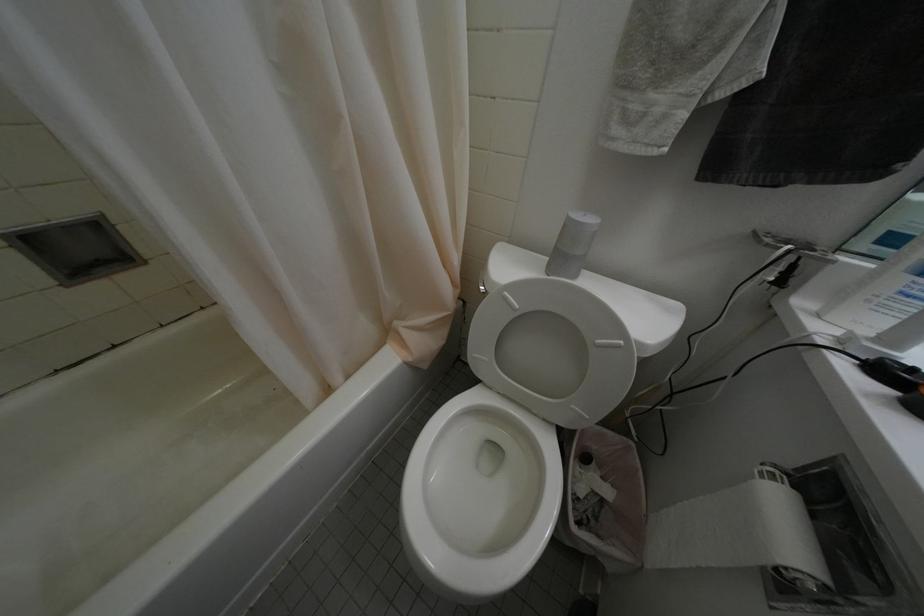
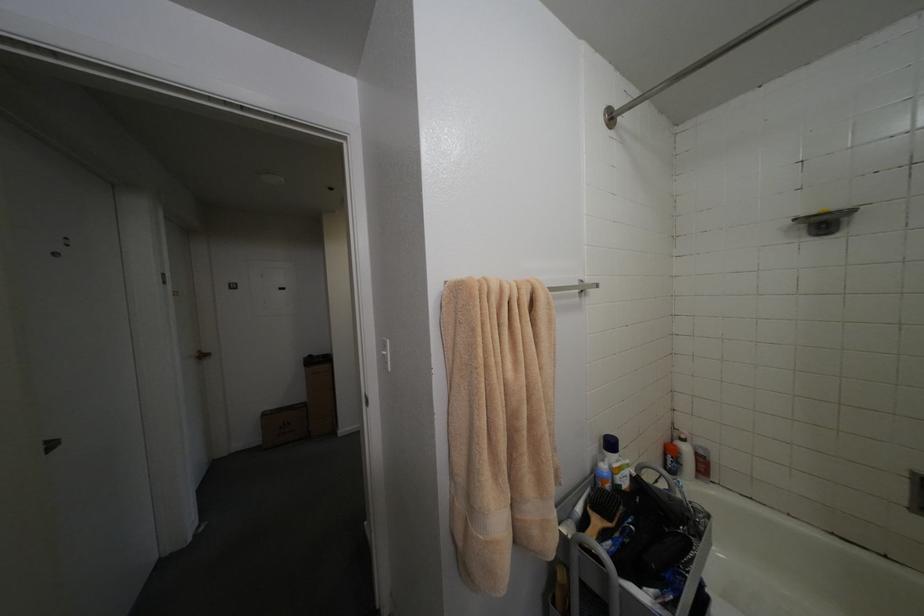
Question: The camera is either moving clockwise (left) or counter-clockwise (right) around the object. The first image is from the beginning of the video and the second image is from the end. Is the camera moving left or right when shooting the video?

Choices:
 (A) Left
 (B) Right

Answer: (B)